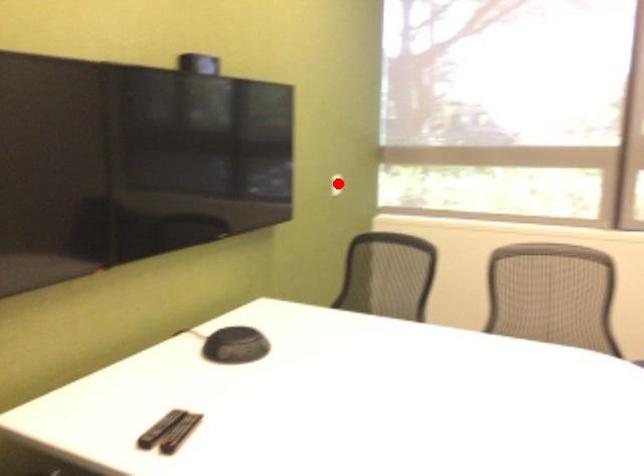
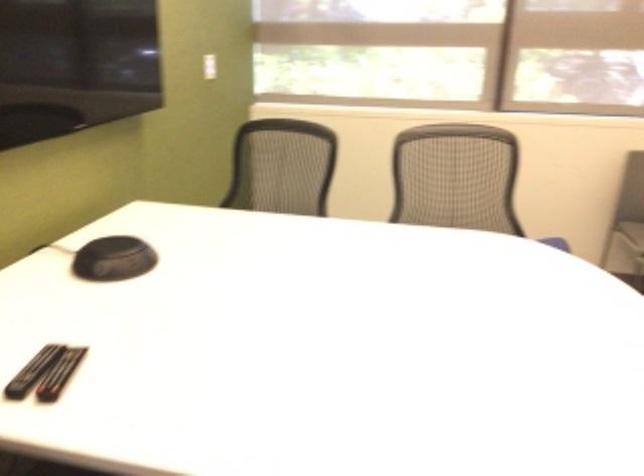
Question: A red point is marked in image1. In image2, is the corresponding 3D point closer to the camera or farther? Reply with the corresponding letter.

Choices:
 (A) The corresponding 3D point is closer.
 (B) The corresponding 3D point is farther.

Answer: (A)